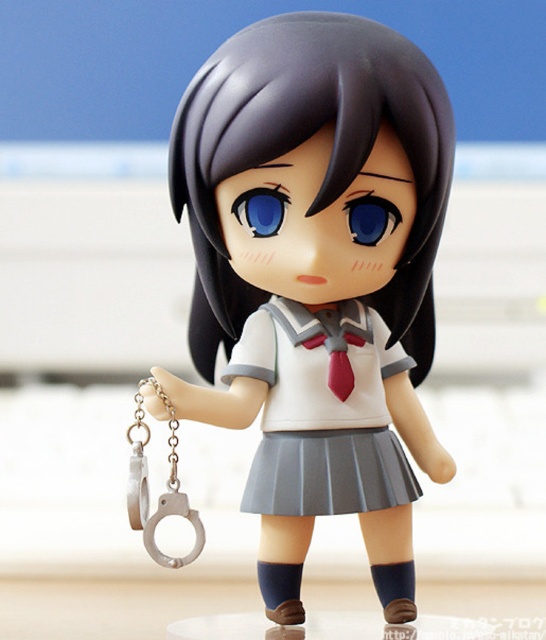
Question: Does matte plastic figure at center lie in front of white matte uniform skirt at center?

Choices:
 (A) no
 (B) yes

Answer: (B)

Question: Is matte plastic figure at center below white matte uniform skirt at center?

Choices:
 (A) yes
 (B) no

Answer: (B)

Question: Which point appears closest to the camera in this image?

Choices:
 (A) [337, 426]
 (B) [205, 390]

Answer: (B)

Question: Can you confirm if matte plastic figure at center is positioned above white matte uniform skirt at center?

Choices:
 (A) yes
 (B) no

Answer: (A)

Question: Which object is closer to the camera taking this photo?

Choices:
 (A) matte plastic figure at center
 (B) white matte uniform skirt at center

Answer: (A)

Question: Which of the following is the farthest from the observer?

Choices:
 (A) white matte uniform skirt at center
 (B) matte plastic figure at center

Answer: (A)